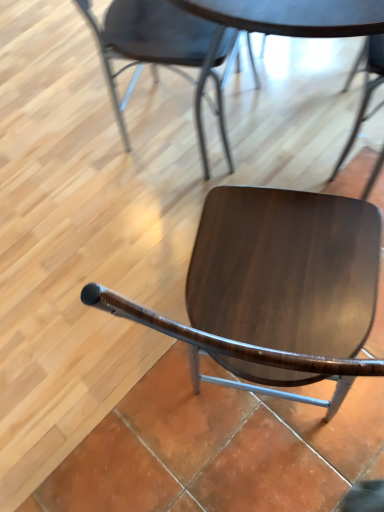
What are the coordinates of `matte black chair at upper center` in the screenshot? It's located at (162, 52).

The image size is (384, 512). What do you see at coordinates (162, 52) in the screenshot? I see `matte black chair at upper center` at bounding box center [162, 52].

What is the approximate height of matte black chair at upper center?

It is 25.77 inches.

This screenshot has width=384, height=512. Find the location of `matte black chair at upper center`. matte black chair at upper center is located at coordinates (162, 52).